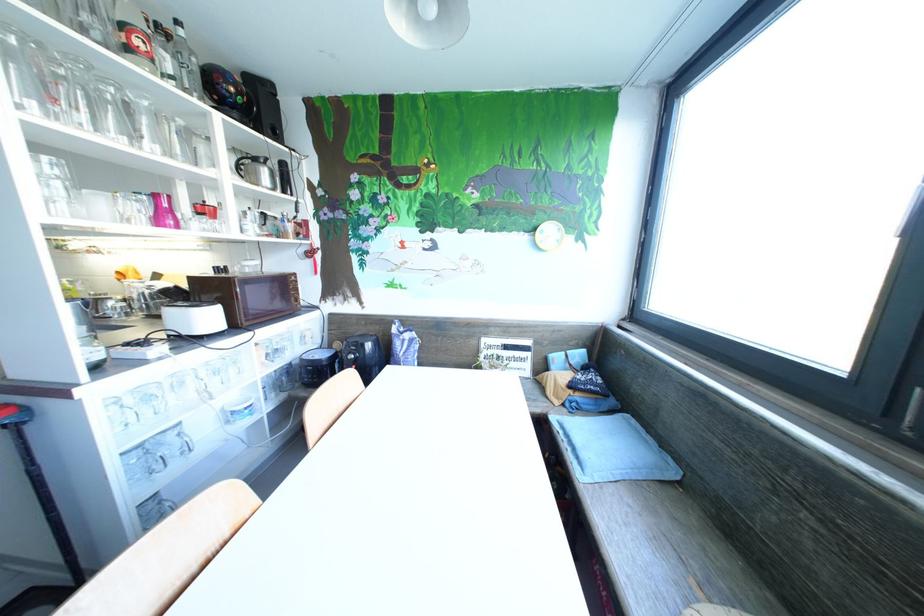
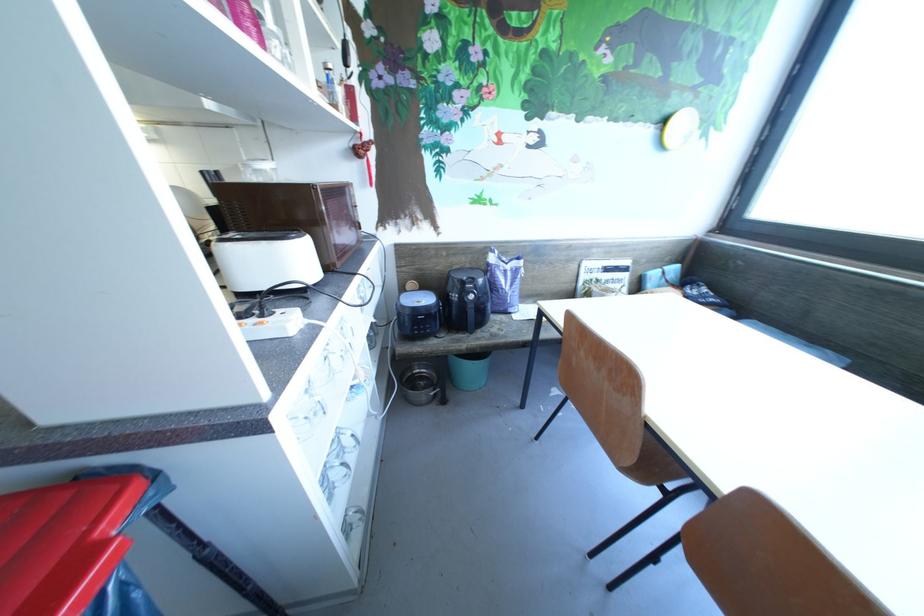
Find the pixel in the second image that matches the point at 408,342 in the first image.

(512, 274)